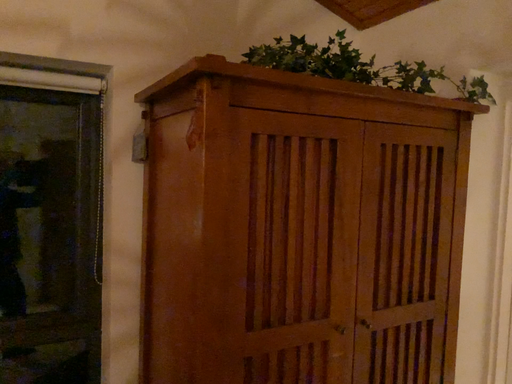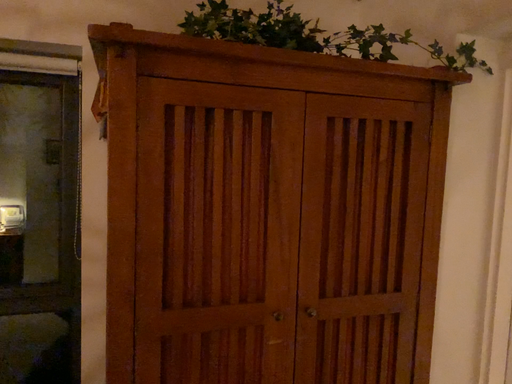
Question: How did the camera likely rotate when shooting the video?

Choices:
 (A) rotated left
 (B) rotated right

Answer: (A)